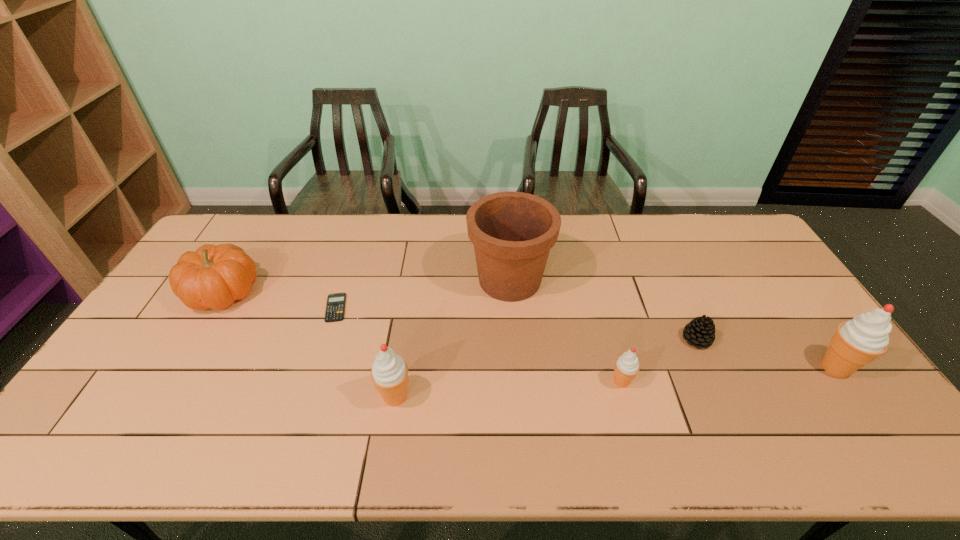
Identify the location of the third tallest object. The image size is (960, 540). (389, 373).

This screenshot has height=540, width=960. Find the location of `the second shortest icecream`. the second shortest icecream is located at coordinates (389, 373).

The height and width of the screenshot is (540, 960). Find the location of `the shortest icecream`. the shortest icecream is located at coordinates (627, 366).

This screenshot has width=960, height=540. I want to click on the third object from right to left, so pos(627,366).

Where is `the rightmost object`? the rightmost object is located at coordinates (857, 342).

At what (x,y) coordinates should I click in order to perform the action: click on calculator. Please return your answer as a coordinate pair (x, y). Looking at the image, I should click on (335, 308).

Where is `the shortest object`? the shortest object is located at coordinates (335, 308).

Locate an element on the screen. This screenshot has width=960, height=540. flowerpot is located at coordinates (512, 232).

The width and height of the screenshot is (960, 540). Find the location of `the second shortest object`. the second shortest object is located at coordinates (700, 332).

Where is `the second object from right to left`? This screenshot has height=540, width=960. the second object from right to left is located at coordinates (700, 332).